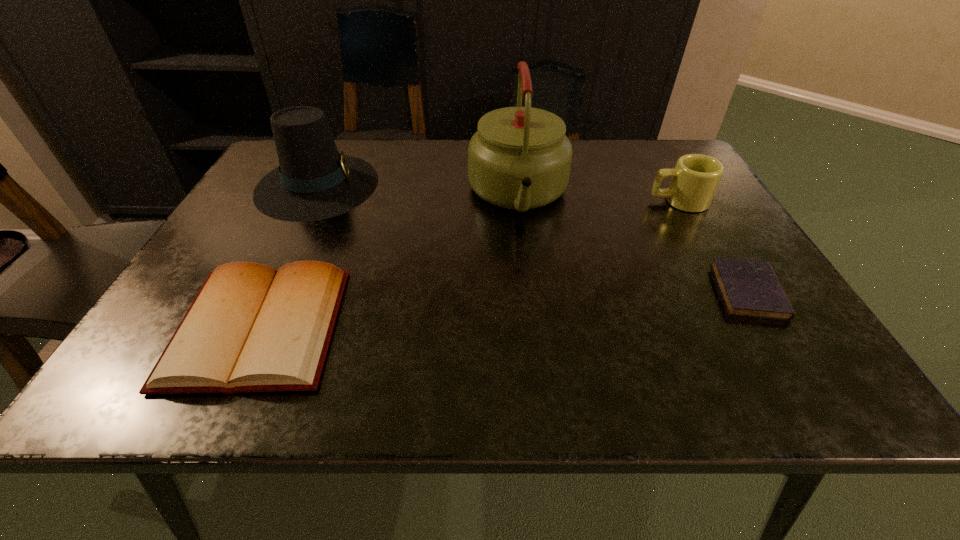
At what (x,y) coordinates should I click in order to perform the action: click on free space that satisfies the following two spatial constraints: 1. at the spout of the shortest object; 2. on the left side of the tallest object. Please return your answer as a coordinate pair (x, y). Image resolution: width=960 pixels, height=540 pixels. Looking at the image, I should click on (529, 292).

I want to click on vacant region that satisfies the following two spatial constraints: 1. on the back side of the Bible; 2. on the front-facing side of the hat, so click(x=324, y=185).

Find the location of a particular element. This screenshot has width=960, height=540. vacant area in the image that satisfies the following two spatial constraints: 1. on the front-facing side of the diary; 2. on the left side of the second tallest object is located at coordinates (265, 292).

Locate an element on the screen. The width and height of the screenshot is (960, 540). vacant space that satisfies the following two spatial constraints: 1. with the handle on the side of the mug; 2. on the back side of the shortest object is located at coordinates (730, 292).

Locate an element on the screen. The height and width of the screenshot is (540, 960). vacant space that satisfies the following two spatial constraints: 1. with the handle on the side of the mug; 2. on the back side of the shortest object is located at coordinates (730, 292).

Locate an element on the screen. This screenshot has width=960, height=540. free location that satisfies the following two spatial constraints: 1. with the handle on the side of the shortest object; 2. on the right side of the mug is located at coordinates (730, 292).

This screenshot has height=540, width=960. Find the location of `free space that satisfies the following two spatial constraints: 1. on the back side of the shortest object; 2. on the left side of the second shortest object`. free space that satisfies the following two spatial constraints: 1. on the back side of the shortest object; 2. on the left side of the second shortest object is located at coordinates (276, 292).